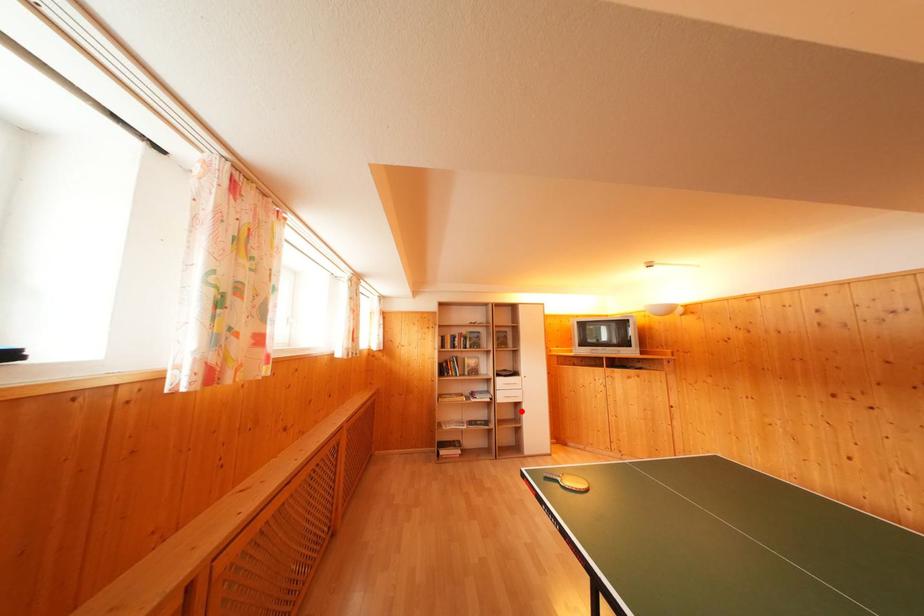
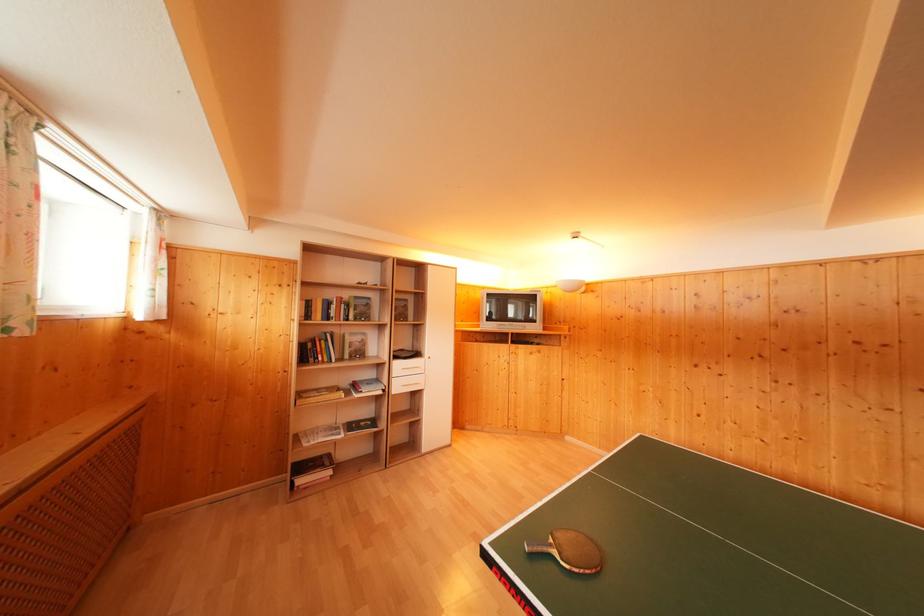
Question: I am providing you with two images of the same scene from different viewpoints. A red point is marked on the first image. Can you still see the location of the red point in image 2?

Choices:
 (A) Yes
 (B) No

Answer: (A)